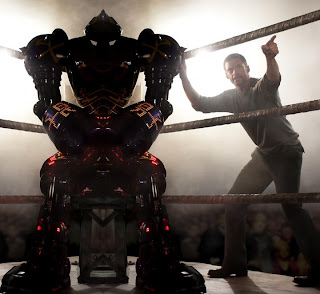
This screenshot has height=294, width=320. In order to click on stool in this screenshot , I will do `click(89, 246)`.